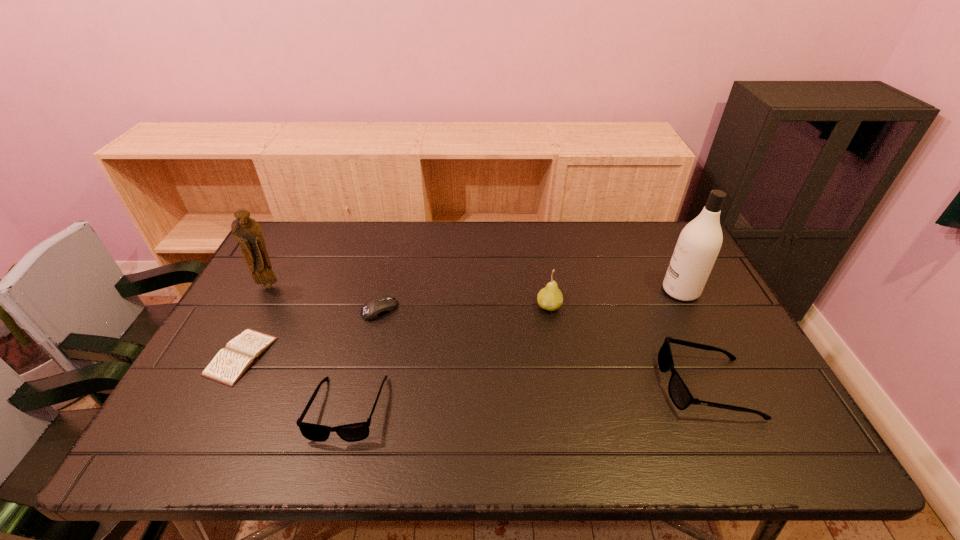
Image resolution: width=960 pixels, height=540 pixels. I want to click on the left sunglasses, so tap(353, 432).

Locate an element on the screen. The width and height of the screenshot is (960, 540). the third shortest object is located at coordinates (353, 432).

Find the location of a particular element. the fourth shortest object is located at coordinates (680, 395).

Find the location of a particular element. The height and width of the screenshot is (540, 960). the taller sunglasses is located at coordinates (680, 395).

This screenshot has width=960, height=540. What are the coordinates of `figurine` in the screenshot? It's located at (247, 232).

You are a GUI agent. You are given a task and a screenshot of the screen. Output one action in this format:
    pyautogui.click(x=<x>, y=<y>)
    Task: Click on the fifth shortest object
    This screenshot has width=960, height=540.
    Given the screenshot: What is the action you would take?
    pyautogui.click(x=550, y=298)

Locate an element on the screen. The width and height of the screenshot is (960, 540). the third object from right to left is located at coordinates (550, 298).

The image size is (960, 540). In order to click on the sixth tallest object in this screenshot , I will do `click(377, 307)`.

Identify the location of shampoo. The width and height of the screenshot is (960, 540). (699, 243).

This screenshot has width=960, height=540. What are the coordinates of `the shortest object` in the screenshot? It's located at (230, 363).